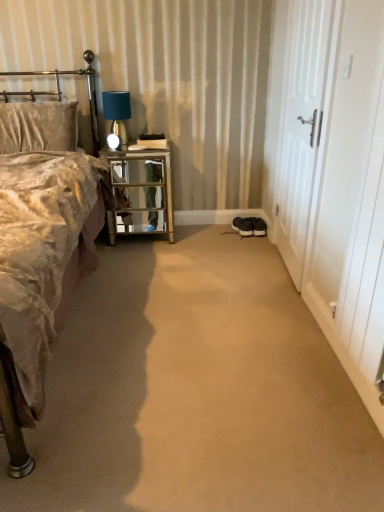
Identify the location of unoccupied area in front of white wooden door at right, the 2th screen door in the front-to-back sequence. click(271, 293).